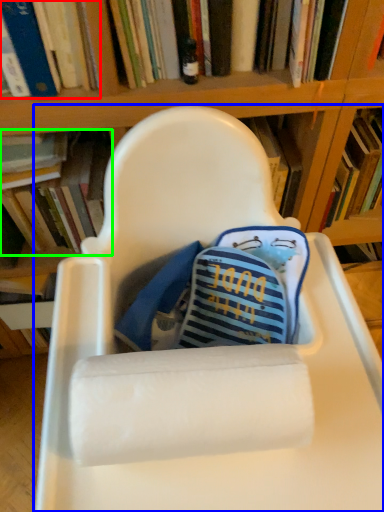
Question: Based on their relative distances, which object is farther from book (highlighted by a red box)? Choose from chair (highlighted by a blue box) and book (highlighted by a green box).

Choices:
 (A) chair
 (B) book

Answer: (A)